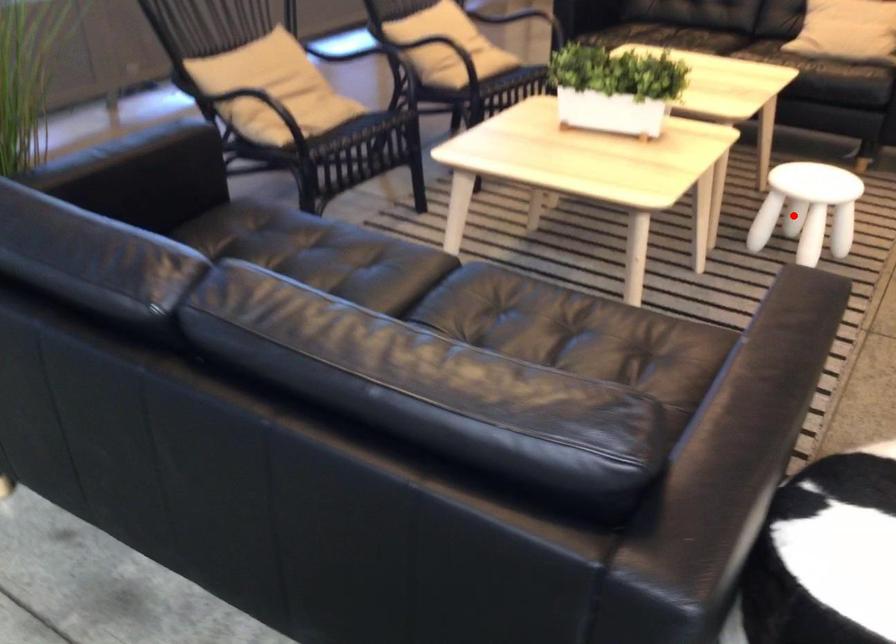
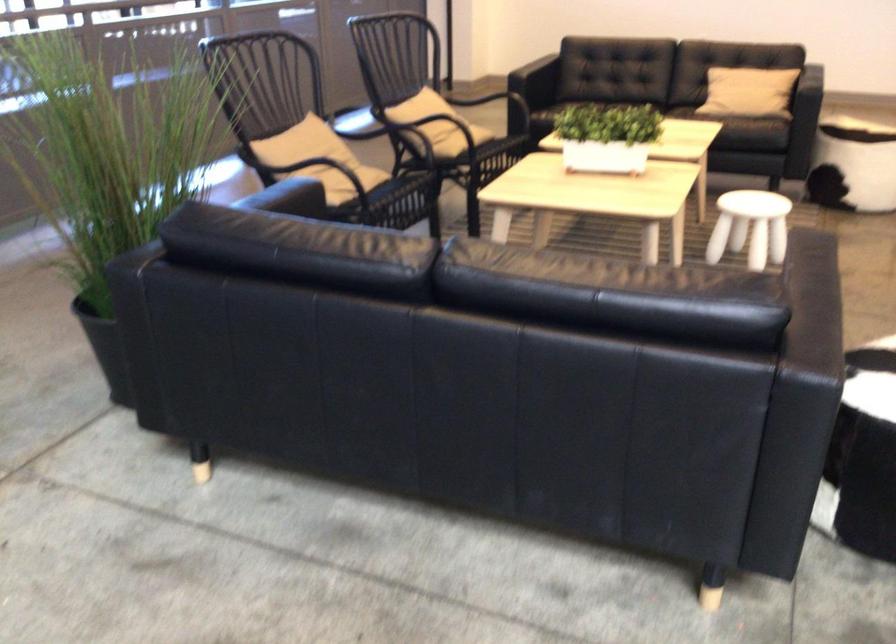
Question: A red point is marked in image1. In image2, is the corresponding 3D point closer to the camera or farther? Reply with the corresponding letter.

Choices:
 (A) The corresponding 3D point is closer.
 (B) The corresponding 3D point is farther.

Answer: (B)